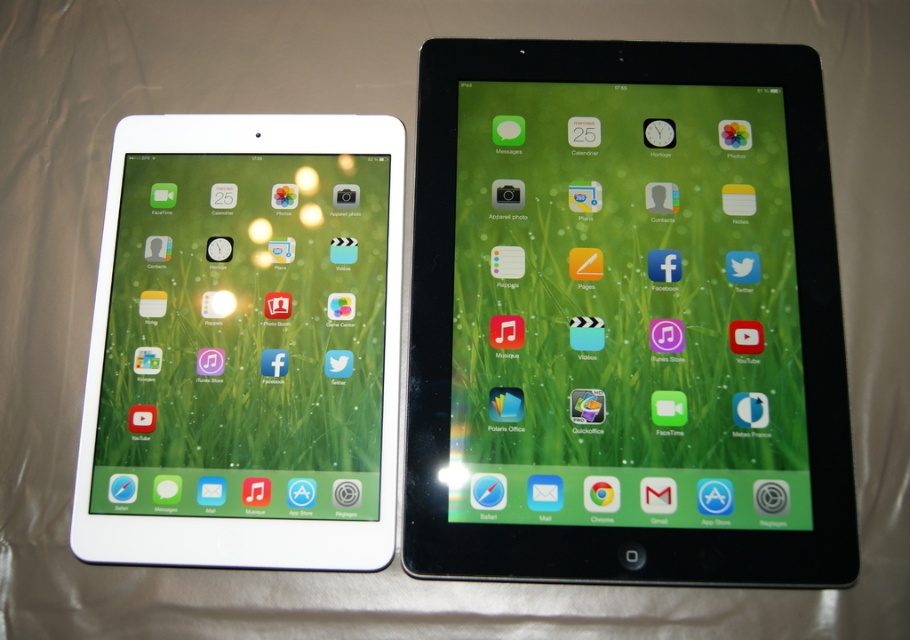
Question: Which point is closer to the camera?

Choices:
 (A) white glossy tablet at left
 (B) black glossy tablet at upper right

Answer: (B)

Question: Where is black glossy tablet at upper right located in relation to white glossy tablet at left in the image?

Choices:
 (A) below
 (B) above

Answer: (B)

Question: Can you confirm if black glossy tablet at upper right is positioned above white glossy tablet at left?

Choices:
 (A) yes
 (B) no

Answer: (A)

Question: Can you confirm if black glossy tablet at upper right is thinner than white glossy tablet at left?

Choices:
 (A) no
 (B) yes

Answer: (A)

Question: Which point is farther to the camera?

Choices:
 (A) (527, 371)
 (B) (321, 339)

Answer: (B)